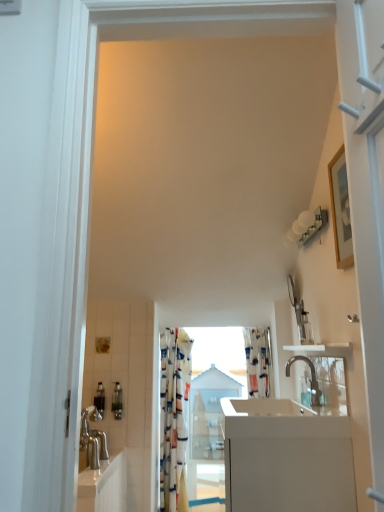
Question: Considering the relative sizes of metallic silver soap dispenser at lower left, which ranks as the 1th toiletry in left-to-right order, and white glossy counter at center in the image provided, is metallic silver soap dispenser at lower left, which ranks as the 1th toiletry in left-to-right order, bigger than white glossy counter at center?

Choices:
 (A) no
 (B) yes

Answer: (A)

Question: Is the depth of metallic silver soap dispenser at lower left, which ranks as the second toiletry in right-to-left order, greater than that of white glossy counter at center?

Choices:
 (A) yes
 (B) no

Answer: (A)

Question: Can you confirm if metallic silver soap dispenser at lower left, which ranks as the second toiletry in right-to-left order, is taller than white glossy counter at center?

Choices:
 (A) yes
 (B) no

Answer: (B)

Question: Is metallic silver soap dispenser at lower left, which ranks as the 1th toiletry in left-to-right order, located outside white glossy counter at center?

Choices:
 (A) yes
 (B) no

Answer: (A)

Question: Considering the relative sizes of metallic silver soap dispenser at lower left, which ranks as the 1th toiletry in left-to-right order, and white glossy counter at center in the image provided, is metallic silver soap dispenser at lower left, which ranks as the 1th toiletry in left-to-right order, wider than white glossy counter at center?

Choices:
 (A) yes
 (B) no

Answer: (B)

Question: Relative to metallic silver soap dispenser at lower left, which ranks as the 1th toiletry in left-to-right order, is patterned fabric curtain at center in front or behind?

Choices:
 (A) behind
 (B) front

Answer: (A)

Question: Do you think patterned fabric curtain at center is within metallic silver soap dispenser at lower left, which ranks as the second toiletry in right-to-left order, or outside of it?

Choices:
 (A) outside
 (B) inside

Answer: (A)

Question: In terms of height, does patterned fabric curtain at center look taller or shorter compared to metallic silver soap dispenser at lower left, which ranks as the second toiletry in right-to-left order?

Choices:
 (A) tall
 (B) short

Answer: (A)

Question: Would you say patterned fabric curtain at center is to the left or to the right of metallic silver soap dispenser at lower left, which ranks as the 1th toiletry in left-to-right order, in the picture?

Choices:
 (A) right
 (B) left

Answer: (A)

Question: Looking at their shapes, would you say white glossy counter at center is wider or thinner than white glossy sink at lower center?

Choices:
 (A) thin
 (B) wide

Answer: (A)

Question: From the image's perspective, is white glossy counter at center positioned above or below white glossy sink at lower center?

Choices:
 (A) above
 (B) below

Answer: (B)

Question: From a real-world perspective, relative to white glossy sink at lower center, is white glossy counter at center vertically above or below?

Choices:
 (A) below
 (B) above

Answer: (A)

Question: In terms of height, does white glossy counter at center look taller or shorter compared to white glossy sink at lower center?

Choices:
 (A) tall
 (B) short

Answer: (A)

Question: Looking at the image, does metallic silver soap dispenser at lower left, the first toiletry from the right, seem bigger or smaller compared to patterned fabric curtain at center?

Choices:
 (A) big
 (B) small

Answer: (B)

Question: Looking at their shapes, would you say metallic silver soap dispenser at lower left, the first toiletry from the right, is wider or thinner than patterned fabric curtain at center?

Choices:
 (A) thin
 (B) wide

Answer: (A)